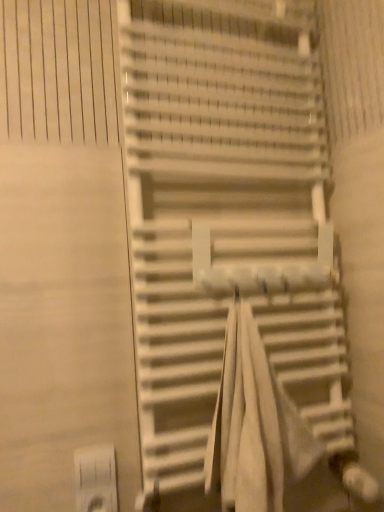
Question: Is white fabric beach towel at center next to white plastic electric outlet at lower left and touching it?

Choices:
 (A) no
 (B) yes

Answer: (A)

Question: From the image's perspective, is white fabric beach towel at center on white plastic electric outlet at lower left?

Choices:
 (A) yes
 (B) no

Answer: (A)

Question: Could you tell me if white fabric beach towel at center is facing white plastic electric outlet at lower left?

Choices:
 (A) yes
 (B) no

Answer: (B)

Question: Considering the relative sizes of white fabric beach towel at center and white plastic electric outlet at lower left in the image provided, is white fabric beach towel at center smaller than white plastic electric outlet at lower left?

Choices:
 (A) no
 (B) yes

Answer: (A)

Question: Is white fabric beach towel at center not near white plastic electric outlet at lower left?

Choices:
 (A) yes
 (B) no

Answer: (B)

Question: Considering the relative positions of white fabric beach towel at center and white plastic electric outlet at lower left in the image provided, is white fabric beach towel at center in front of white plastic electric outlet at lower left?

Choices:
 (A) yes
 (B) no

Answer: (A)

Question: Does white plastic electric outlet at lower left turn towards white matte stairs at center?

Choices:
 (A) yes
 (B) no

Answer: (B)

Question: Is white plastic electric outlet at lower left positioned with its back to white matte stairs at center?

Choices:
 (A) yes
 (B) no

Answer: (B)

Question: Are white plastic electric outlet at lower left and white matte stairs at center far apart?

Choices:
 (A) no
 (B) yes

Answer: (A)

Question: Considering the relative positions of white plastic electric outlet at lower left and white matte stairs at center in the image provided, is white plastic electric outlet at lower left to the right of white matte stairs at center from the viewer's perspective?

Choices:
 (A) yes
 (B) no

Answer: (B)

Question: Is white matte stairs at center completely or partially inside white plastic electric outlet at lower left?

Choices:
 (A) no
 (B) yes

Answer: (A)

Question: Can we say white plastic electric outlet at lower left lies outside white matte stairs at center?

Choices:
 (A) no
 (B) yes

Answer: (B)

Question: From the image's perspective, does white plastic electric outlet at lower left appear lower than white fabric beach towel at center?

Choices:
 (A) no
 (B) yes

Answer: (B)